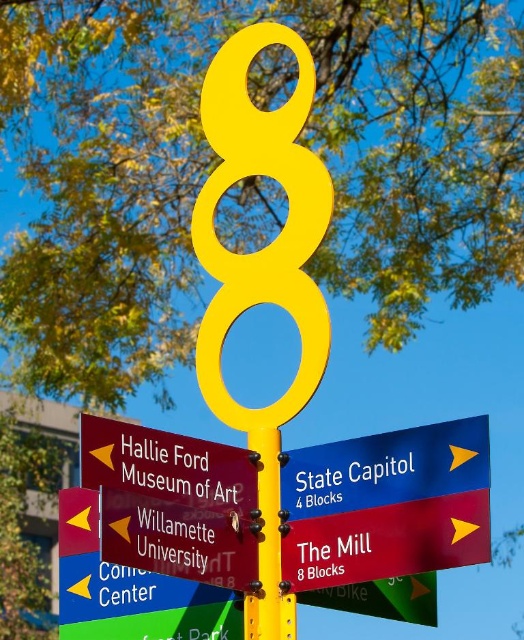
You are standing in front of the signpost and want to know if the metallic red sign at center is attached to the yellow matte pole at center. Can you confirm this based on their positions?

Yes, the metallic red sign at center is positioned over the yellow matte pole at center, indicating it is attached to it.

You are standing in front of the street signpost and notice a metallic red sign at center. Where is it positioned relative to the other signs?

The metallic red sign at center is located at point (x=181, y=538), which places it centrally on the signpost.